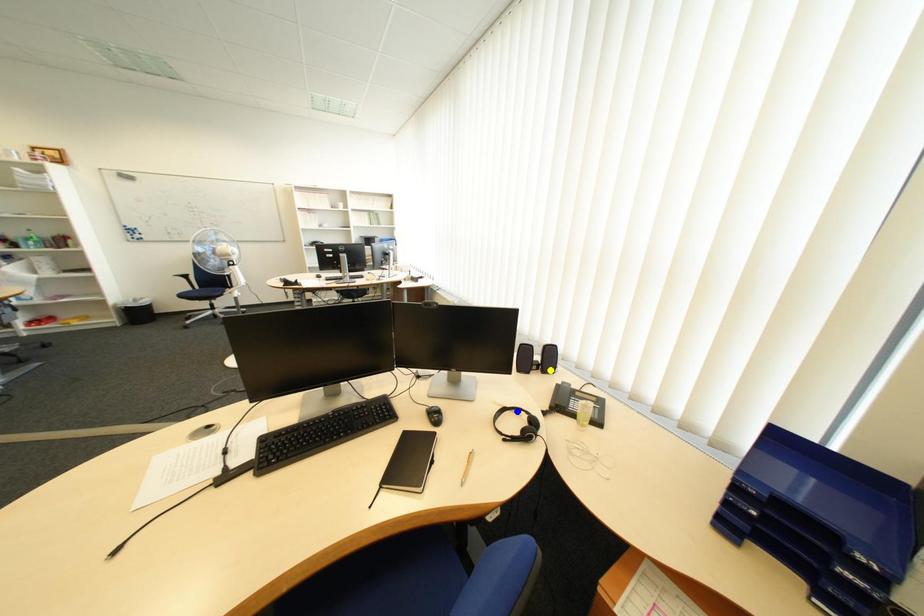
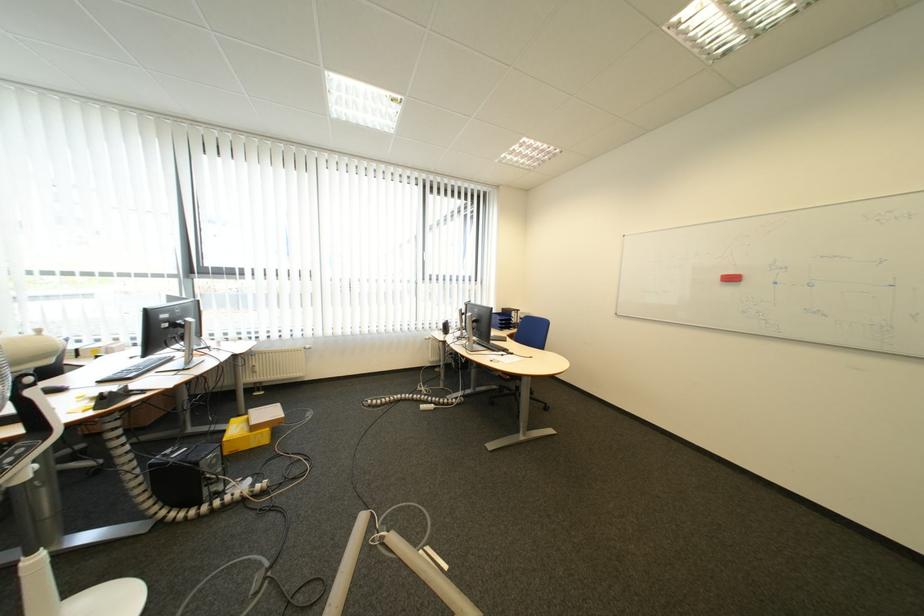
I am providing you with two images of the same scene from different viewpoints. Three points are marked in image1. Which point corresponds to a part or object that is occluded in image2?In image1, three points are marked. Which of them correspond to a part or object that is occluded in image2?Among the three points shown in image1, which one corresponds to a part or object that is no longer visible due to occlusion in image2?

green point, blue point, yellow point